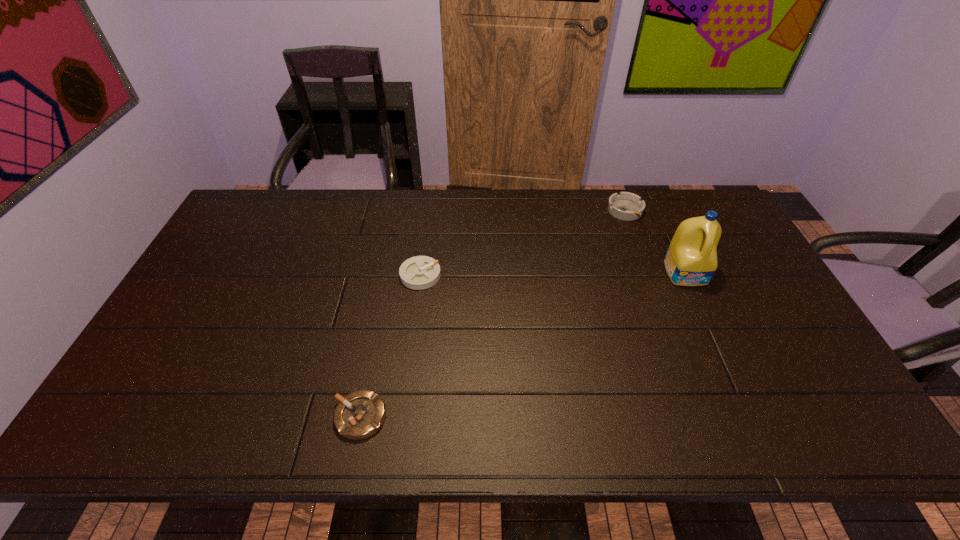
At what (x,y) coordinates should I click in order to perform the action: click on object that is at the near edge. Please return your answer as a coordinate pair (x, y). The width and height of the screenshot is (960, 540). Looking at the image, I should click on (360, 414).

Find the location of a particular element. free point at the far edge is located at coordinates (310, 203).

Image resolution: width=960 pixels, height=540 pixels. What are the coordinates of `vacant space at the near edge` in the screenshot? It's located at (447, 416).

Locate an element on the screen. The width and height of the screenshot is (960, 540). free space at the left edge is located at coordinates (171, 327).

This screenshot has width=960, height=540. What are the coordinates of `vacant space at the right edge of the desktop` in the screenshot? It's located at [768, 375].

This screenshot has width=960, height=540. In the image, there is a desktop. Find the location of `vacant space at the far left corner`. vacant space at the far left corner is located at coordinates (250, 227).

Locate an element on the screen. The width and height of the screenshot is (960, 540). free space between the nearest object and the farthest ashtray is located at coordinates (492, 314).

Image resolution: width=960 pixels, height=540 pixels. In order to click on free space between the farthest ashtray and the nearest ashtray in this screenshot , I will do `click(492, 314)`.

Identify the location of unoccupied position between the second farthest ashtray and the tallest object. (553, 274).

Identify the location of unoccupied area between the tallest object and the third shortest object. The width and height of the screenshot is (960, 540). (656, 242).